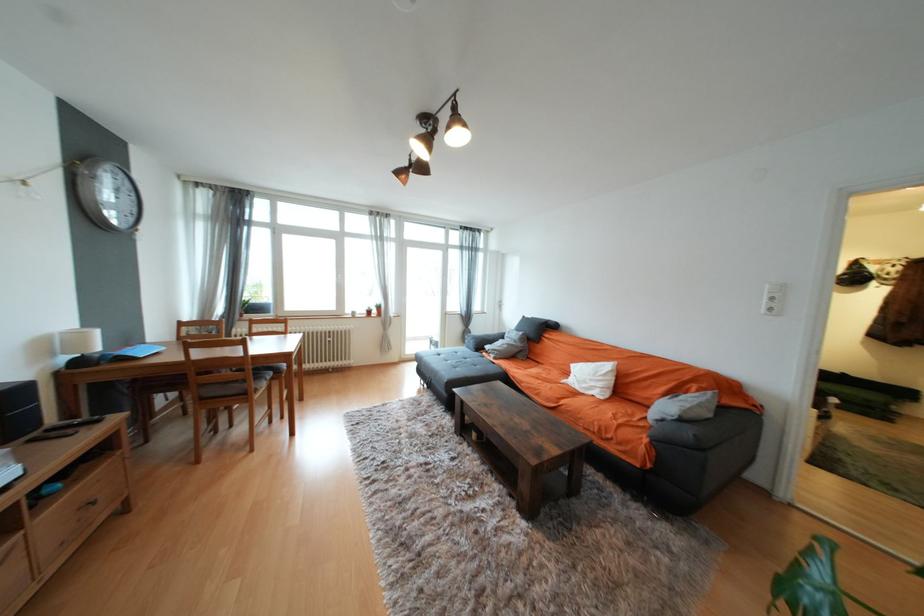
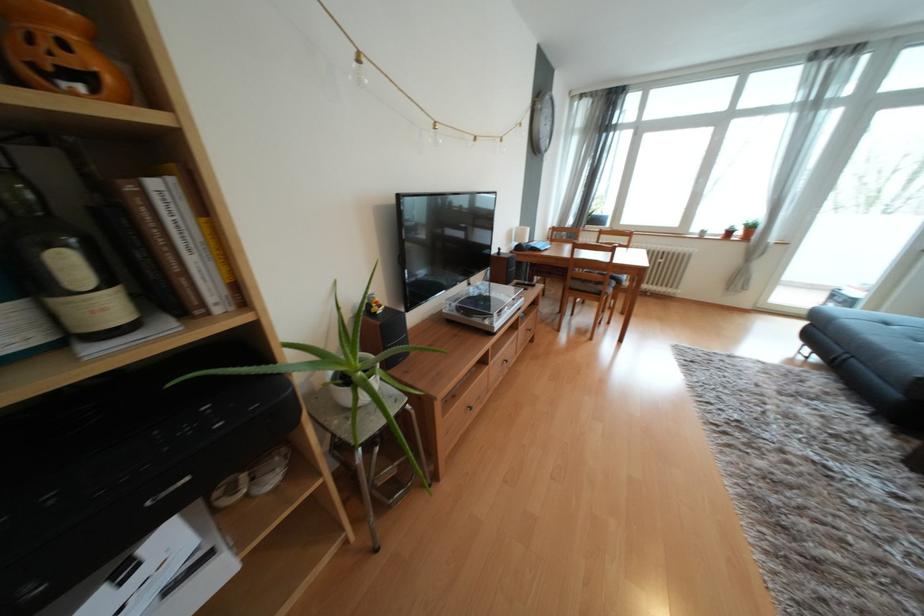
Find the pixel in the second image that matches the point at 390,464 in the first image.

(745, 424)